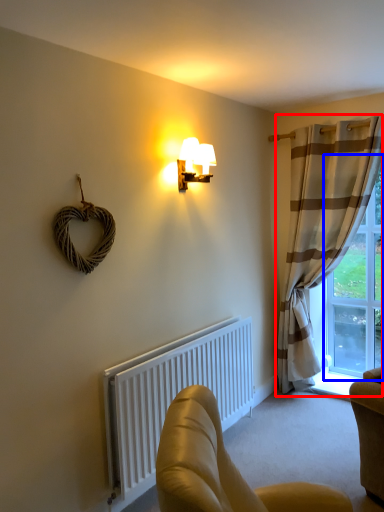
Question: Which object is closer to the camera taking this photo, curtain (highlighted by a red box) or window (highlighted by a blue box)?

Choices:
 (A) curtain
 (B) window

Answer: (A)